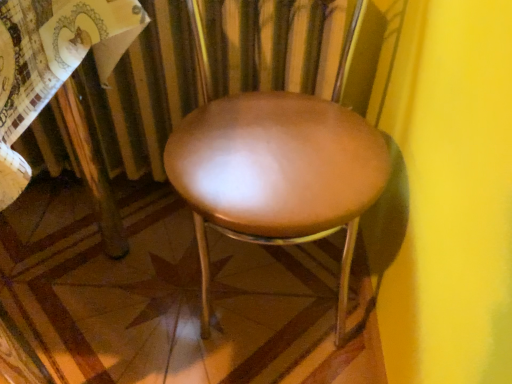
At what (x,y) coordinates should I click in order to perform the action: click on metallic gold radiator at upper center. Please return your answer as a coordinate pair (x, y). This screenshot has height=384, width=512. Looking at the image, I should click on (147, 74).

What do you see at coordinates (147, 74) in the screenshot?
I see `metallic gold radiator at upper center` at bounding box center [147, 74].

The image size is (512, 384). Identify the location of metallic gold radiator at upper center. (147, 74).